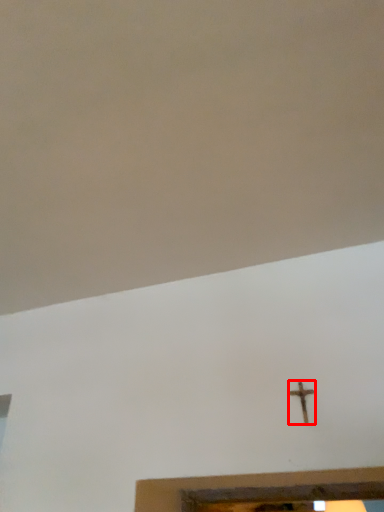
Question: Considering the relative positions of nail (annotated by the red box) and backdrop in the image provided, where is nail (annotated by the red box) located with respect to the staircase?

Choices:
 (A) left
 (B) right

Answer: (B)